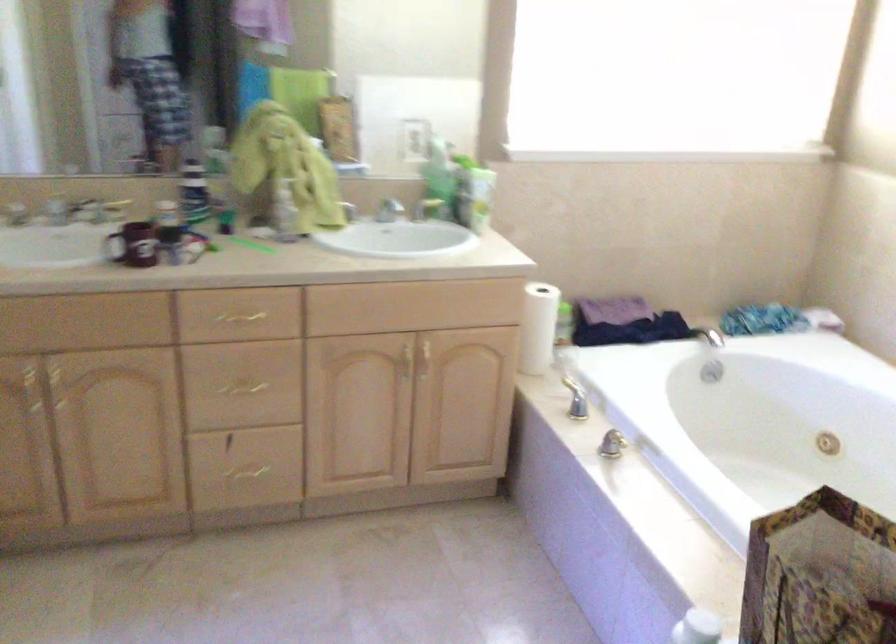
I want to click on faucet handle, so click(x=575, y=399).